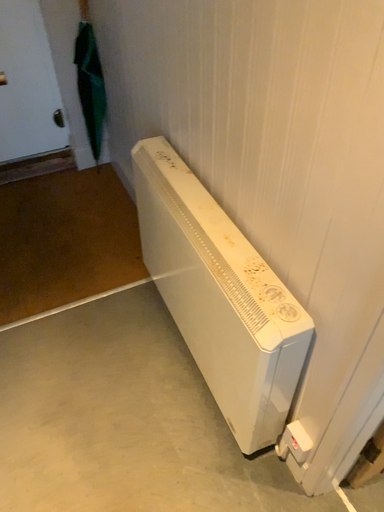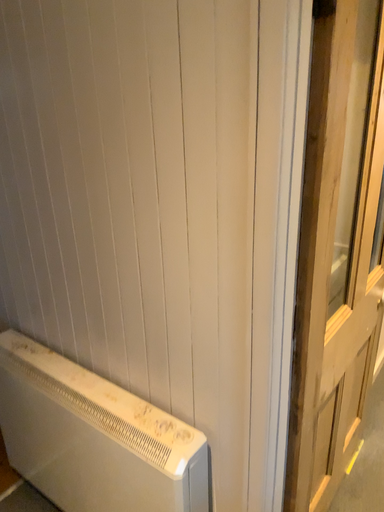
Question: Which way did the camera rotate in the video?

Choices:
 (A) rotated upward
 (B) rotated downward

Answer: (A)